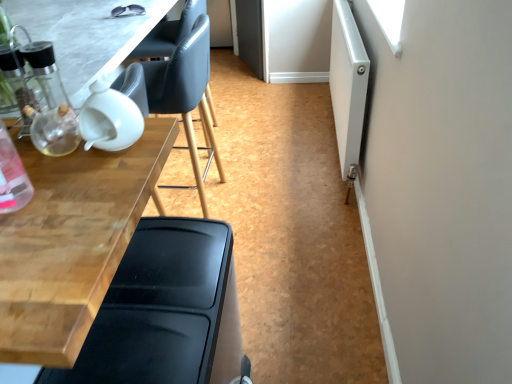
Locate an element on the screen. The width and height of the screenshot is (512, 384). blank space situated above white matte screen door at right (from a real-world perspective) is located at coordinates (348, 28).